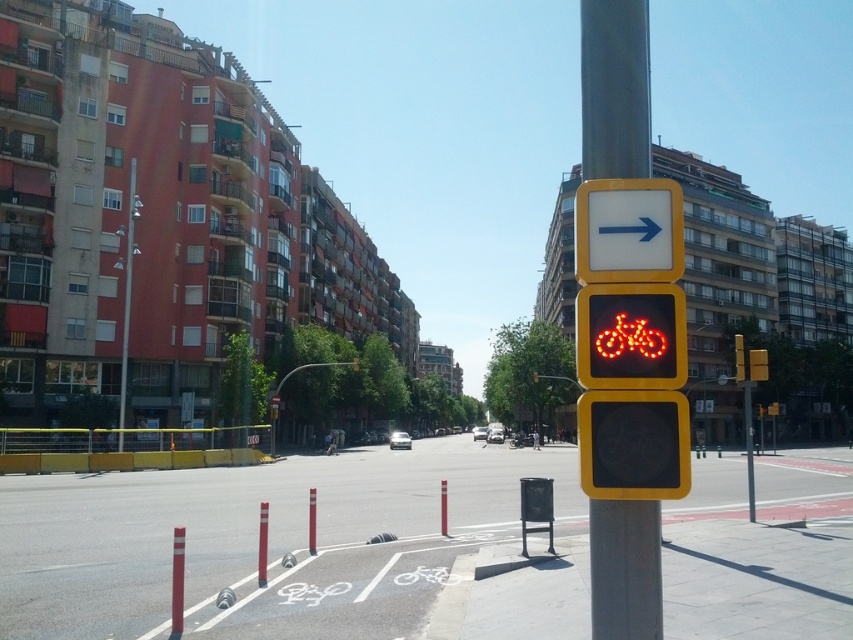
You are a cyclist approaching an intersection and see the yellow plastic pole at right and the led illuminated bicycle at right. Which object is closer to you?

The yellow plastic pole at right is closer to you because it is further to the viewer than the led illuminated bicycle at right.

You are a cyclist approaching an intersection and see the led illuminated bicycle at right and the metallic pole at left. Which direction should you turn to follow the bicycle lane indicated by the traffic signals?

The led illuminated bicycle at right is positioned on the right side of metallic pole at left, so you should turn right to follow the bicycle lane indicated by the traffic signals.